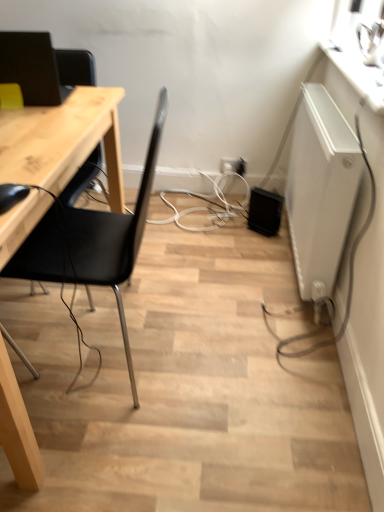
This screenshot has height=512, width=384. Find the location of `unoccupied area in front of white matte radiator at right`. unoccupied area in front of white matte radiator at right is located at coordinates (268, 345).